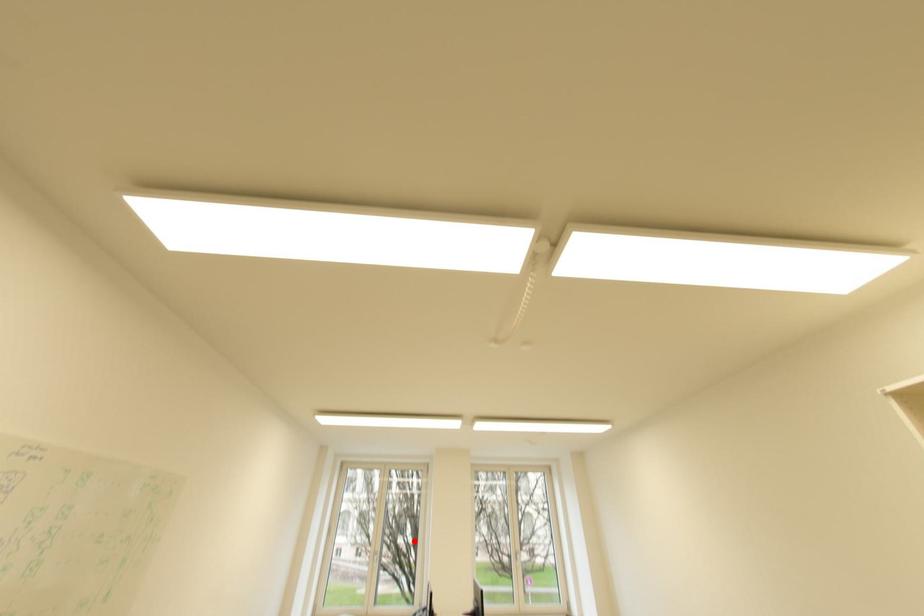
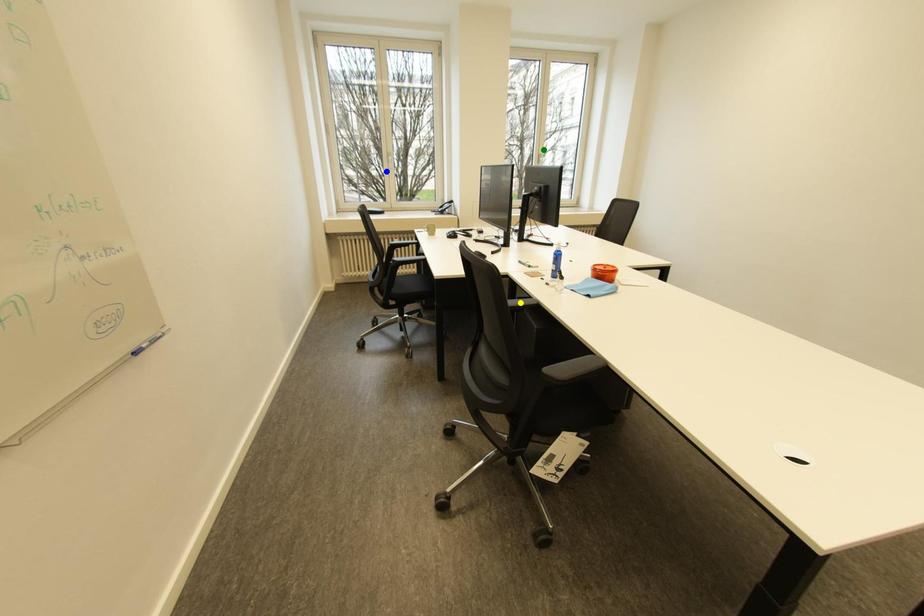
Question: I am providing you with two images of the same scene from different viewpoints. A red point is marked on the first image. You are given multiple points on the second image. Which point in image 2 represents the same 3d spot as the red point in image 1?

Choices:
 (A) green point
 (B) blue point
 (C) yellow point

Answer: (B)